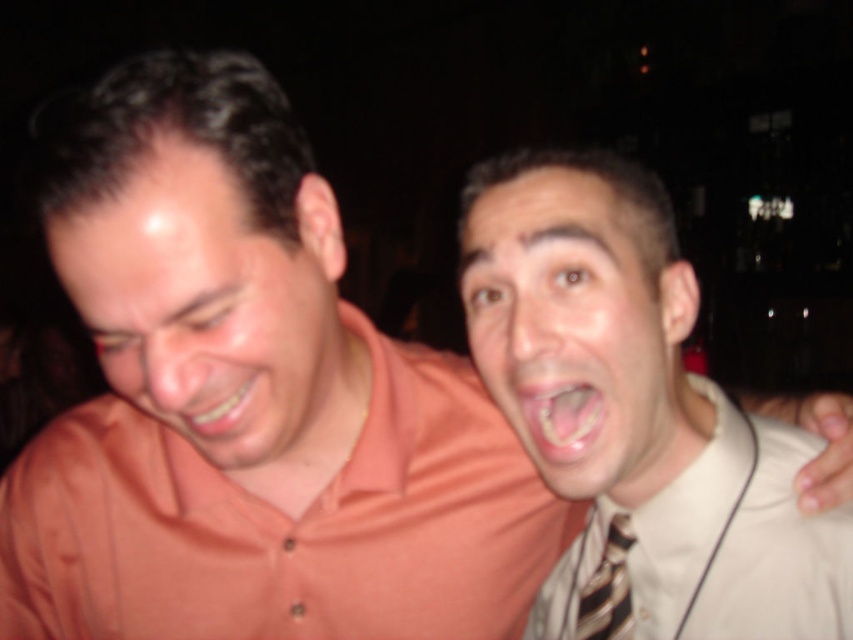
Question: Is pink glossy tongue at center below striped fabric tie at right?

Choices:
 (A) yes
 (B) no

Answer: (B)

Question: Among these points, which one is farthest from the camera?

Choices:
 (A) (593, 404)
 (B) (624, 541)
 (C) (213, 406)
 (D) (541, 378)

Answer: (B)

Question: Can you confirm if smooth skin face at right is thinner than striped fabric tie at right?

Choices:
 (A) yes
 (B) no

Answer: (B)

Question: Can you confirm if smooth skin face at right is positioned below white textured dress shirt at right?

Choices:
 (A) no
 (B) yes

Answer: (A)

Question: Which of the following is the farthest from the observer?

Choices:
 (A) (830, 528)
 (B) (489, 292)
 (C) (592, 627)

Answer: (C)

Question: Which object appears farthest from the camera in this image?

Choices:
 (A) striped fabric tie at right
 (B) pink glossy tongue at center

Answer: (A)